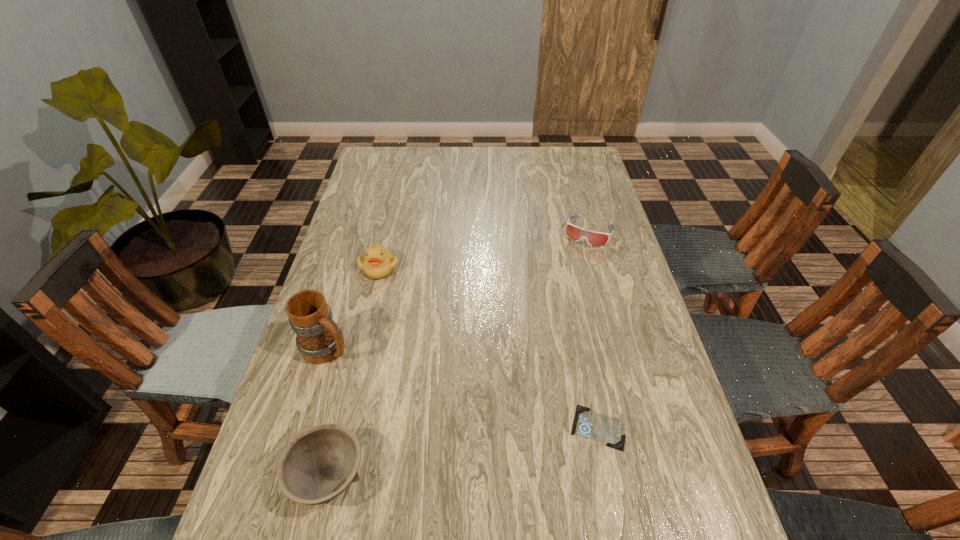
The image size is (960, 540). I want to click on free space located on the side of the third farthest object with the handle, so click(462, 442).

At what (x,y) coordinates should I click in order to perform the action: click on free space located on the side of the third farthest object with the handle. Please return your answer as a coordinate pair (x, y). The image size is (960, 540). Looking at the image, I should click on (407, 402).

The width and height of the screenshot is (960, 540). In order to click on free space located on the side of the third farthest object with the handle in this screenshot , I will do `click(469, 448)`.

In order to click on vacant area located on the beak of the duckling in this screenshot , I will do (x=393, y=291).

Find the location of a particular element. Image resolution: width=960 pixels, height=540 pixels. blank area located 0.400m on the beak of the duckling is located at coordinates (445, 384).

Image resolution: width=960 pixels, height=540 pixels. Find the location of `free region located 0.110m on the beak of the duckling`. free region located 0.110m on the beak of the duckling is located at coordinates (400, 304).

In order to click on vacant area situated on the front-facing side of the goggles in this screenshot , I will do `click(560, 295)`.

The width and height of the screenshot is (960, 540). What are the coordinates of `vacant space located on the front-facing side of the goggles` in the screenshot? It's located at (576, 259).

Where is `free space located on the front-facing side of the goggles`? The width and height of the screenshot is (960, 540). free space located on the front-facing side of the goggles is located at coordinates (550, 315).

Locate an element on the screen. The image size is (960, 540). object that is at the near edge is located at coordinates (320, 463).